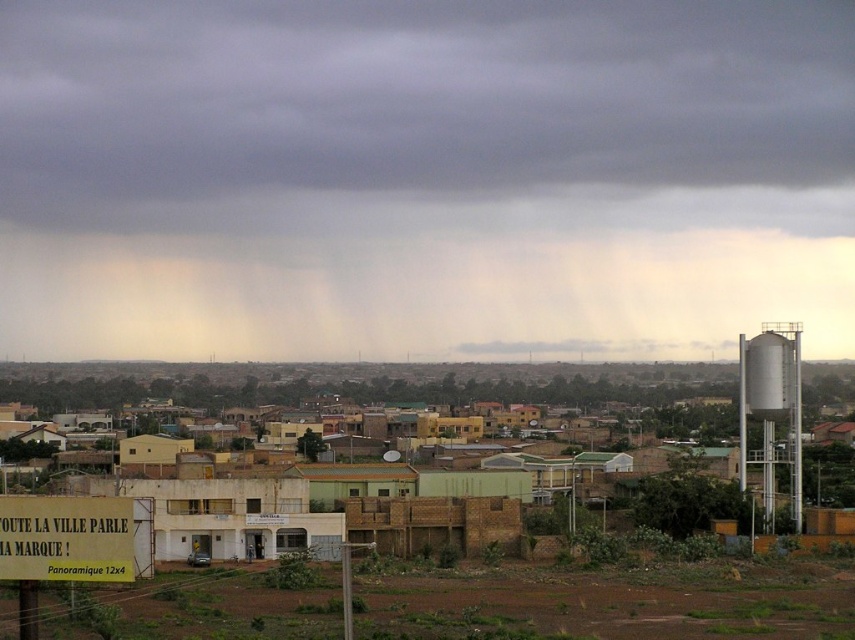
You are a delivery drone with a maximum flight range of 70 meters. You need to deliver a package from the yellow brick building at center to the green leafy bush at lower right. Can you complete the delivery without needing a recharge?

The yellow brick building at center and the green leafy bush at lower right are 65.11 meters apart from each other. Since the distance is within your 70 meter range, yes, you can complete the delivery without needing a recharge.

You are a photographer standing at the camera position. You want to capture the dark gray cloud at upper center in your photo. The camera has a focal length of 50mm. What is the minimum distance you need to move backward to focus on the cloud?

The dark gray cloud at upper center is 305.01 meters away from camera. To focus on it, the photographer must be at least 305.01 meters away from the cloud. Since the photographer is already at the camera position, they don not need to move backward. The current distance is sufficient for focusing.